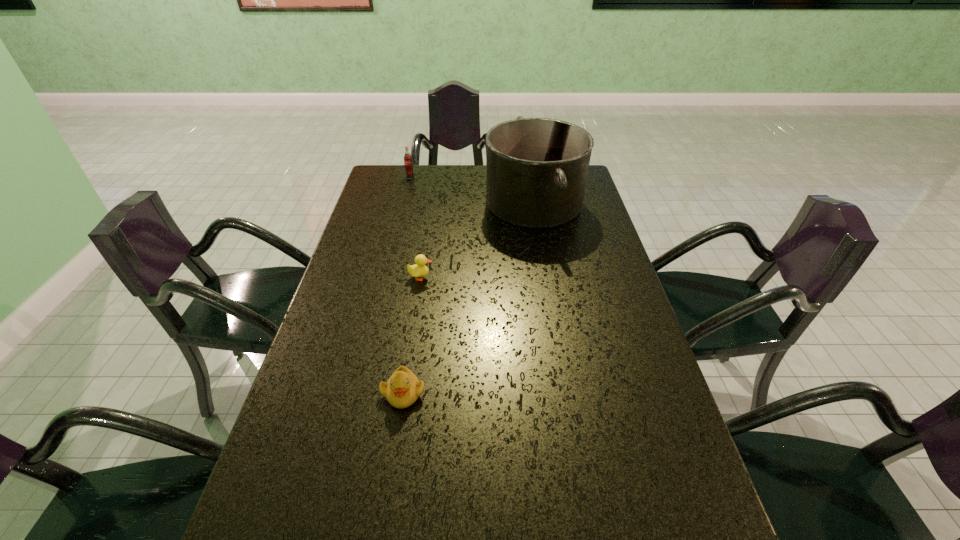
Identify the location of pan situated at the far edge. The width and height of the screenshot is (960, 540). (537, 168).

Identify the location of soda bottle situated at the far edge. Image resolution: width=960 pixels, height=540 pixels. (408, 164).

This screenshot has width=960, height=540. I want to click on object present at the left edge, so click(x=408, y=164).

At what (x,y) coordinates should I click in order to perform the action: click on object positioned at the right edge. Please return your answer as a coordinate pair (x, y). The image size is (960, 540). Looking at the image, I should click on (537, 168).

This screenshot has height=540, width=960. What are the coordinates of `object present at the far left corner` in the screenshot? It's located at (408, 164).

Where is `object positioned at the far right corner`? This screenshot has width=960, height=540. object positioned at the far right corner is located at coordinates (537, 168).

This screenshot has width=960, height=540. In order to click on free point at the left edge in this screenshot , I will do `click(312, 380)`.

The width and height of the screenshot is (960, 540). Find the location of `free space at the right edge of the desktop`. free space at the right edge of the desktop is located at coordinates (655, 425).

Find the location of a particular element. free space at the far left corner of the desktop is located at coordinates (402, 188).

I want to click on vacant area that lies between the rightmost object and the third farthest object, so click(x=477, y=240).